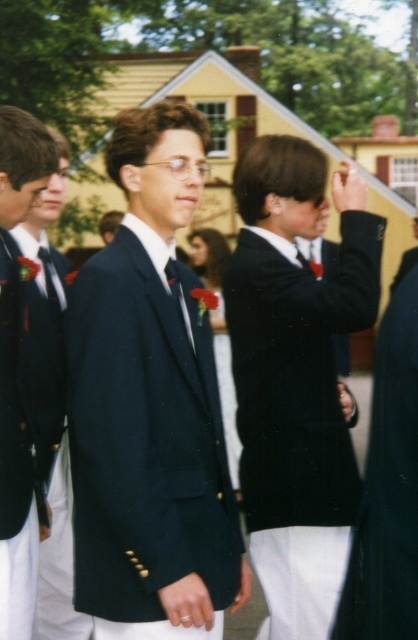
Question: Based on their relative distances, which object is farther from the matte black blazer at center?

Choices:
 (A) navy blue suit at center
 (B) matte black blazer at left

Answer: (B)

Question: Based on their relative distances, which object is farther from the matte black blazer at center?

Choices:
 (A) matte black blazer at left
 (B) navy blue suit at center

Answer: (A)

Question: Is navy blue suit at center below matte black blazer at center?

Choices:
 (A) no
 (B) yes

Answer: (A)

Question: Is navy blue suit at center above matte black blazer at left?

Choices:
 (A) no
 (B) yes

Answer: (A)

Question: Is matte black blazer at center behind matte black blazer at left?

Choices:
 (A) yes
 (B) no

Answer: (A)

Question: Which point is farther from the camera taking this photo?

Choices:
 (A) (244, 422)
 (B) (2, 579)

Answer: (A)